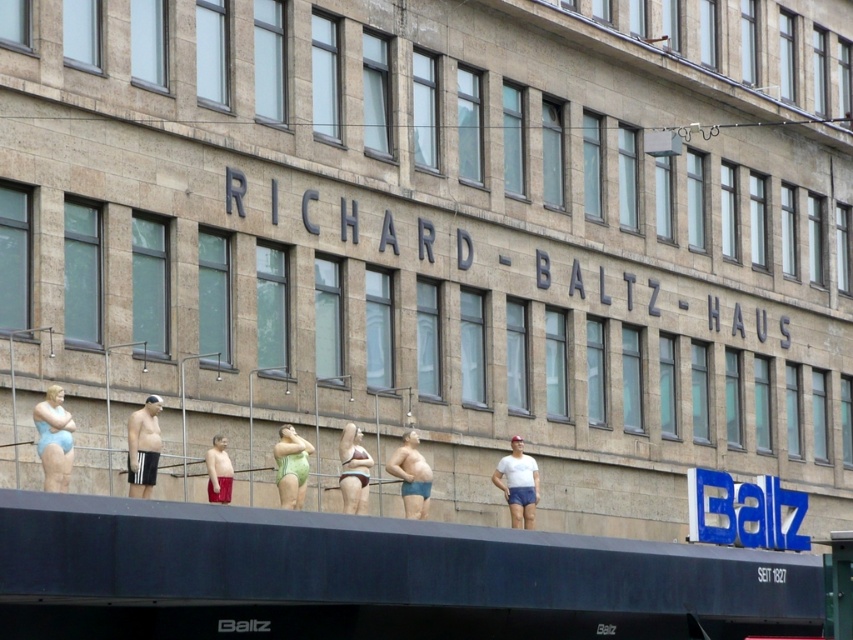
Question: Which of the following is the farthest from the observer?

Choices:
 (A) (288, 467)
 (B) (405, 433)

Answer: (B)

Question: Estimate the real-world distances between objects in this image. Which object is farther from the matte red shorts at center?

Choices:
 (A) green matte swimsuit at center
 (B) matte blue shorts at center
 (C) matte green swimsuit at center
 (D) matte blue swimsuit at left

Answer: (B)

Question: Does matte blue swimsuit at left come behind white matte shorts at center?

Choices:
 (A) yes
 (B) no

Answer: (B)

Question: Is white matte shorts at center positioned at the back of matte blue shorts at center?

Choices:
 (A) yes
 (B) no

Answer: (A)

Question: Is matte blue swimsuit at left to the left of matte red shorts at center from the viewer's perspective?

Choices:
 (A) yes
 (B) no

Answer: (A)

Question: Which of the following is the farthest from the observer?

Choices:
 (A) green matte swimsuit at center
 (B) matte blue shorts at center
 (C) black adidas shorts at left
 (D) white matte shorts at center

Answer: (D)